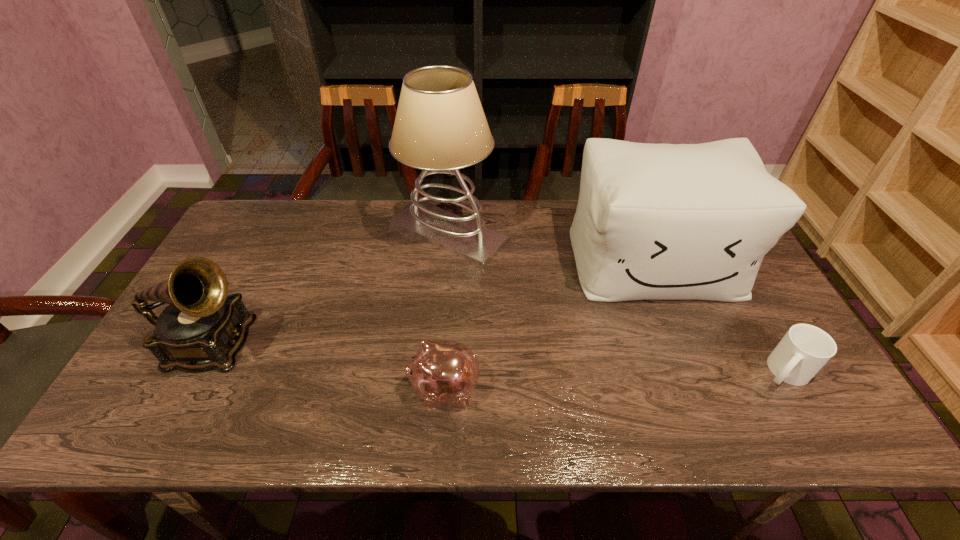
Image resolution: width=960 pixels, height=540 pixels. I want to click on free space that is in between the mug and the phonograph record, so click(498, 358).

Identify the location of unoccupied position between the cushion and the second shortest object. The image size is (960, 540). (549, 325).

The width and height of the screenshot is (960, 540). What are the coordinates of `object that can be found as the closest to the cushion` in the screenshot? It's located at (805, 349).

Image resolution: width=960 pixels, height=540 pixels. I want to click on the second closest object to the piggy bank, so click(x=440, y=127).

Where is `free spot that satisfies the following two spatial constraints: 1. on the front side of the shortest object; 2. on the front facing side of the fourth tallest object`? free spot that satisfies the following two spatial constraints: 1. on the front side of the shortest object; 2. on the front facing side of the fourth tallest object is located at coordinates (794, 389).

At what (x,y) coordinates should I click in order to perform the action: click on free location that satisfies the following two spatial constraints: 1. on the horn of the shortest object; 2. on the left side of the phonograph record. Please return your answer as a coordinate pair (x, y). Looking at the image, I should click on (198, 372).

At what (x,y) coordinates should I click in order to perform the action: click on blank space that satisfies the following two spatial constraints: 1. on the side of the shortest object with the smiley face; 2. on the left side of the cushion. Please return your answer as a coordinate pair (x, y). Looking at the image, I should click on (698, 372).

Where is `vacant point that satisfies the following two spatial constraints: 1. on the front side of the tallest object; 2. on the horn of the leftmost object`? The height and width of the screenshot is (540, 960). vacant point that satisfies the following two spatial constraints: 1. on the front side of the tallest object; 2. on the horn of the leftmost object is located at coordinates (439, 345).